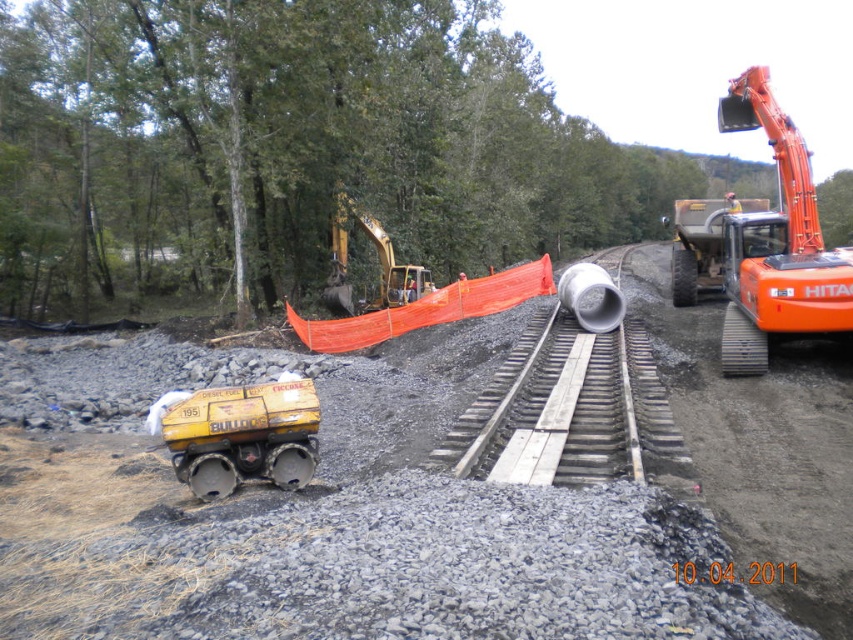
Can you confirm if matte yellow bulldozer at lower left is positioned above orange metallic excavator at right?

Actually, matte yellow bulldozer at lower left is below orange metallic excavator at right.

Between point (404, 512) and point (757, 328), which one is positioned in front?

Positioned in front is point (404, 512).

Looking at this image, who is more distant from viewer, (433, 589) or (767, 260)?

The point (767, 260) is behind.

Where is `matte yellow bulldozer at lower left`? matte yellow bulldozer at lower left is located at coordinates (397, 509).

Can you confirm if matte yellow bulldozer at lower left is smaller than yellow matte fuel tank at lower left?

No, matte yellow bulldozer at lower left is not smaller than yellow matte fuel tank at lower left.

Is point (676, 561) positioned before point (196, 481)?

Yes, it is in front of point (196, 481).

Is point (561, 516) behind point (292, 436)?

No.

In order to click on matte yellow bulldozer at lower left in this screenshot , I will do `click(397, 509)`.

Does orange metallic excavator at right have a greater width compared to yellow matte fuel tank at lower left?

Indeed, orange metallic excavator at right has a greater width compared to yellow matte fuel tank at lower left.

Can you confirm if orange metallic excavator at right is positioned to the right of yellow matte fuel tank at lower left?

Yes, orange metallic excavator at right is to the right of yellow matte fuel tank at lower left.

Is point (746, 104) more distant than point (177, 406)?

Yes, point (746, 104) is farther from viewer.

The height and width of the screenshot is (640, 853). I want to click on orange metallic excavator at right, so click(762, 243).